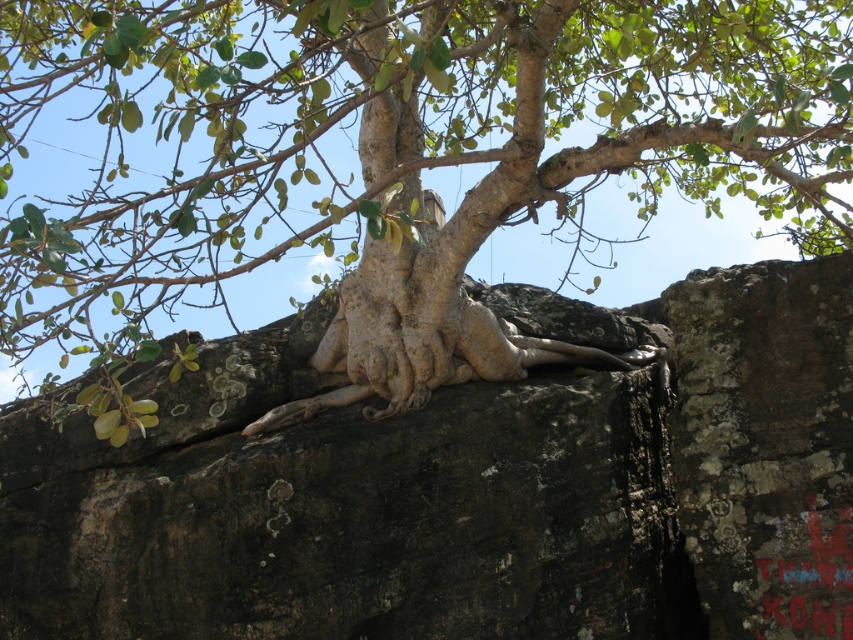
Question: From the image, what is the correct spatial relationship of brown rough rock at center in relation to bark-like textured tree trunk at center?

Choices:
 (A) above
 (B) below

Answer: (B)

Question: Is brown rough rock at center above bark-like textured tree trunk at center?

Choices:
 (A) yes
 (B) no

Answer: (B)

Question: Among these objects, which one is farthest from the camera?

Choices:
 (A) brown rough rock at center
 (B) bark-like textured tree trunk at center

Answer: (A)

Question: Does brown rough rock at center come behind bark-like textured tree trunk at center?

Choices:
 (A) yes
 (B) no

Answer: (A)